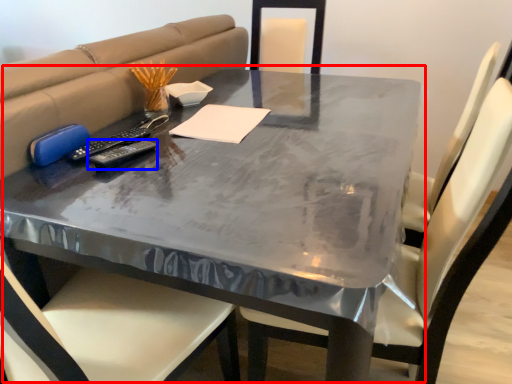
Question: Which object appears closest to the camera in this image, table (highlighted by a red box) or remote (highlighted by a blue box)?

Choices:
 (A) table
 (B) remote

Answer: (A)